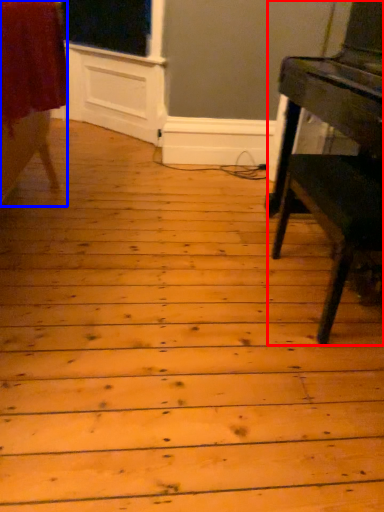
Question: Which object appears closest to the camera in this image, table (highlighted by a red box) or furniture (highlighted by a blue box)?

Choices:
 (A) table
 (B) furniture

Answer: (A)